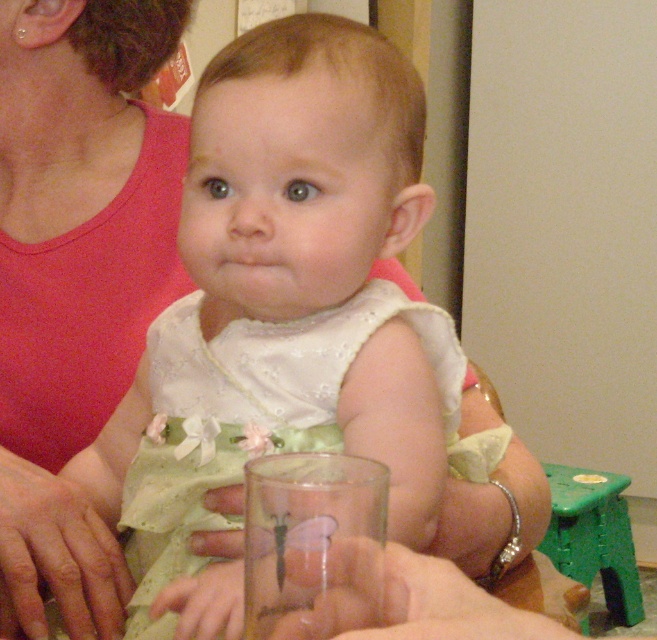
Question: Which of the following is the closest to the observer?

Choices:
 (A) transparent glass at center
 (B) white satin dress at center

Answer: (A)

Question: Among these objects, which one is nearest to the camera?

Choices:
 (A) white satin dress at center
 (B) transparent glass at center
 (C) matte pink tank top at upper left

Answer: (B)

Question: Is white satin dress at center thinner than matte pink tank top at upper left?

Choices:
 (A) no
 (B) yes

Answer: (A)

Question: Does matte pink tank top at upper left have a smaller size compared to transparent glass at center?

Choices:
 (A) no
 (B) yes

Answer: (A)

Question: Which object is positioned closest to the white satin dress at center?

Choices:
 (A) transparent glass at center
 (B) matte pink tank top at upper left

Answer: (B)

Question: Does white satin dress at center appear on the left side of matte pink tank top at upper left?

Choices:
 (A) no
 (B) yes

Answer: (A)